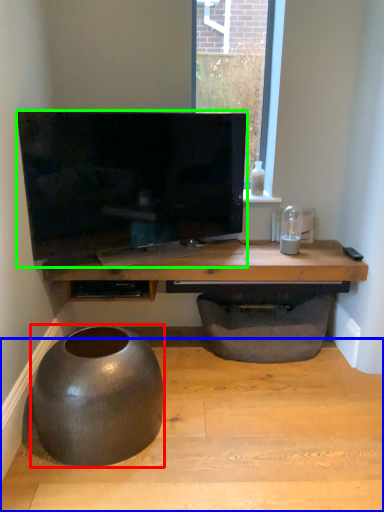
Question: Based on their relative distances, which object is farther from round table (highlighted by a red box)? Choose from concrete (highlighted by a blue box) and television (highlighted by a green box).

Choices:
 (A) concrete
 (B) television

Answer: (B)